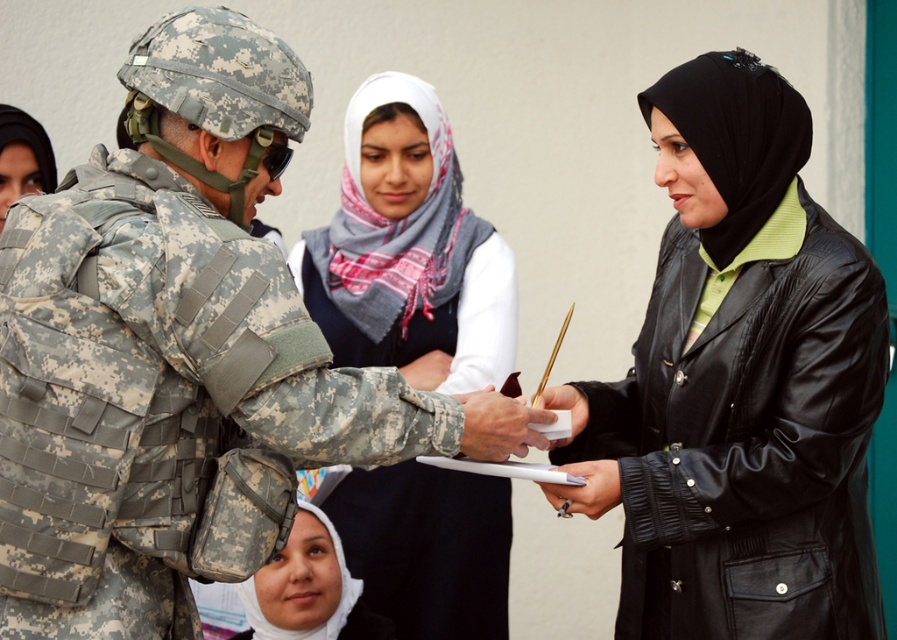
Question: Among these points, which one is nearest to the camera?

Choices:
 (A) (576, 426)
 (B) (825, 499)
 (C) (525, 428)
 (D) (591, 467)

Answer: (C)

Question: Where is white scarf at center located in relation to white matte hijab at lower center in the image?

Choices:
 (A) left
 (B) right

Answer: (B)

Question: Among these points, which one is farthest from the camera?

Choices:
 (A) (146, 202)
 (B) (559, 387)
 (C) (271, 628)

Answer: (C)

Question: Can you confirm if white matte hijab at lower center is bigger than matte military uniform at center?

Choices:
 (A) yes
 (B) no

Answer: (A)

Question: Does camouflage uniform at center appear over white scarf at center?

Choices:
 (A) yes
 (B) no

Answer: (A)

Question: Which of the following is the farthest from the observer?

Choices:
 (A) black leather jacket at right
 (B) camouflage uniform at center
 (C) white matte hijab at lower center

Answer: (C)